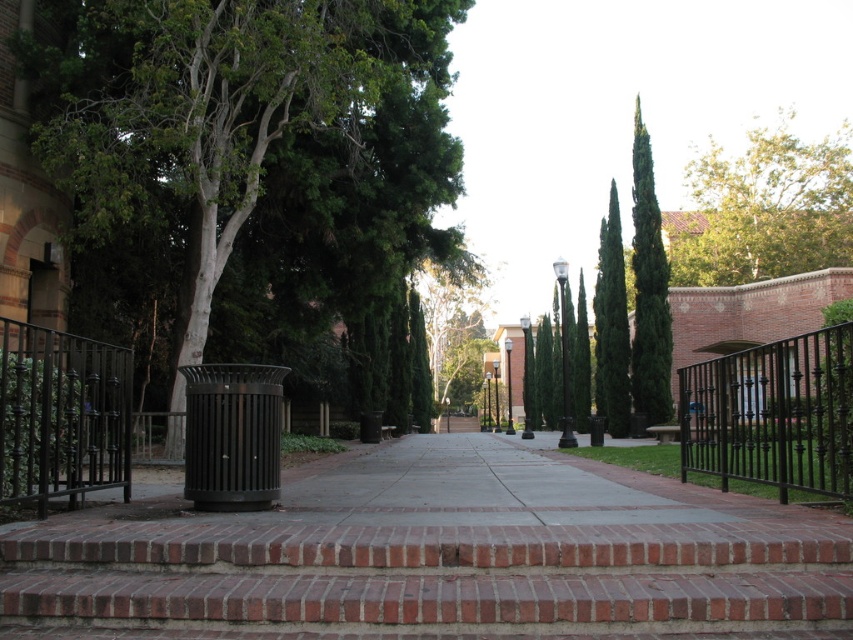
You are standing at the center of the walkway and want to place a bench exactly halfway between the green leafy tree at left and the nearest brick railing. Can you determine the coordinates where the bench should be placed?

The green leafy tree at left is located at point [250,150]. To find the halfway point between it and the nearest brick railing, you would need to calculate the midpoint between these two coordinates. However, the exact coordinates of the brick railing are not provided in the scene description. Without this information, it is impossible to determine the precise location for placing the bench.

You are a maintenance worker assigned to trim the branches of both the green leafy tree at upper right and the green leafy tree at center. Based on their positions, which tree would require you to work at a higher elevation to reach its branches?

The green leafy tree at upper right is positioned over the green leafy tree at center, meaning it is taller. Therefore, trimming its branches would require working at a higher elevation compared to the other tree.